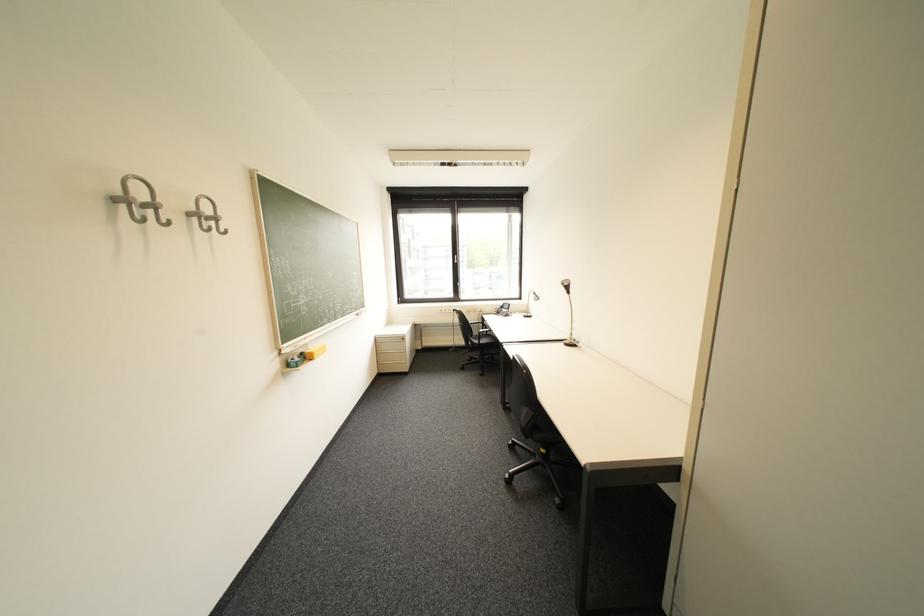
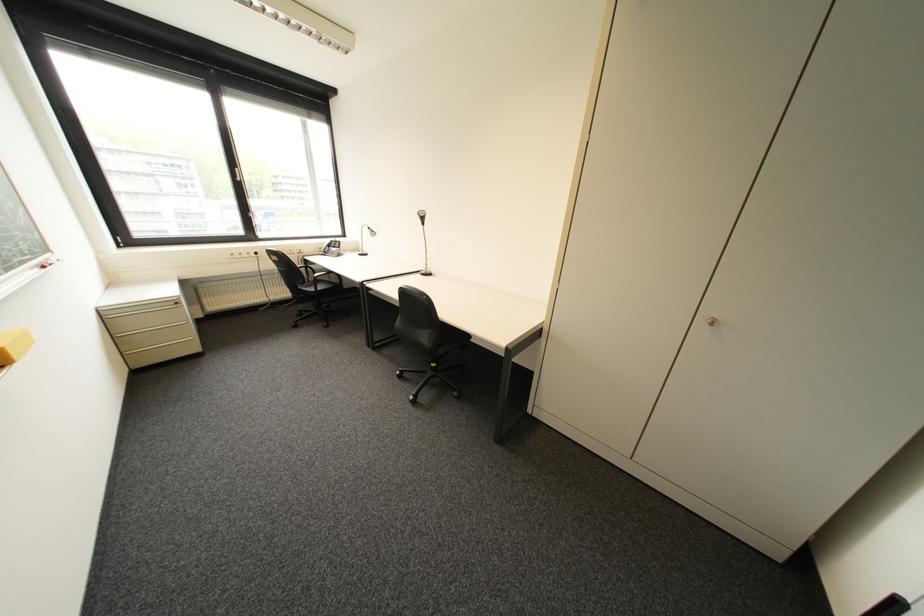
Where in the second image is the point corresponding to (539,424) from the first image?

(444, 342)